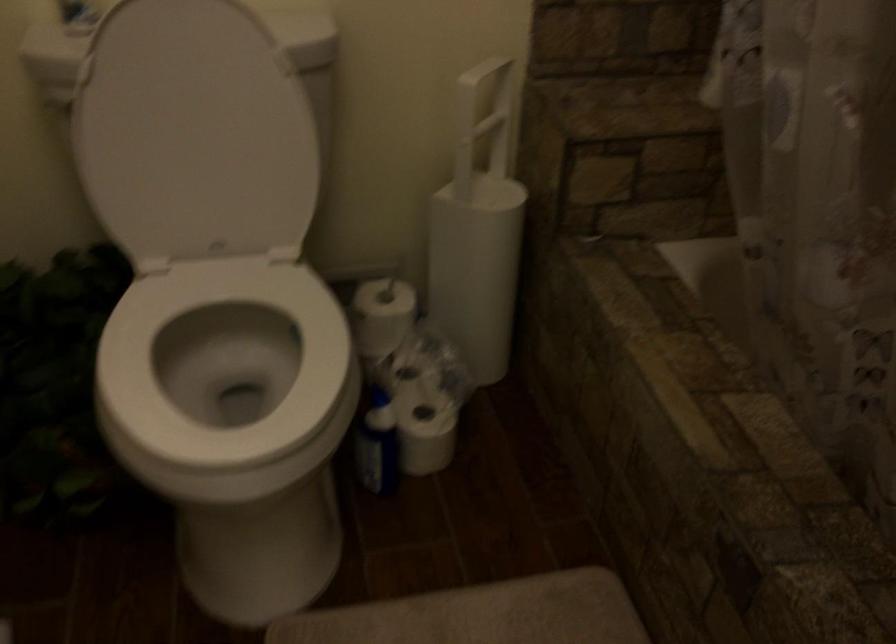
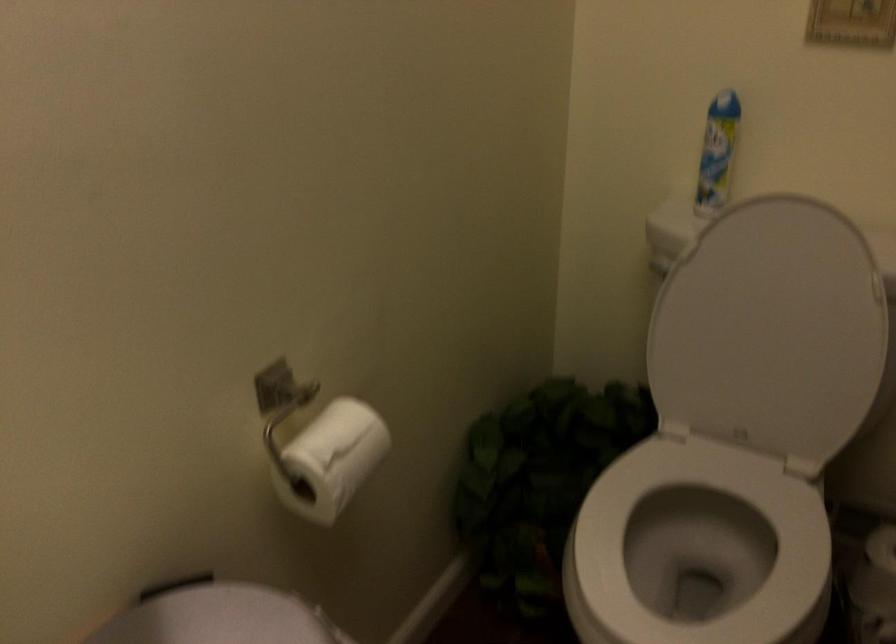
Question: The images are taken continuously from a first-person perspective. In which direction is your viewpoint rotating?

Choices:
 (A) Left
 (B) Right
 (C) Up
 (D) Down

Answer: (A)